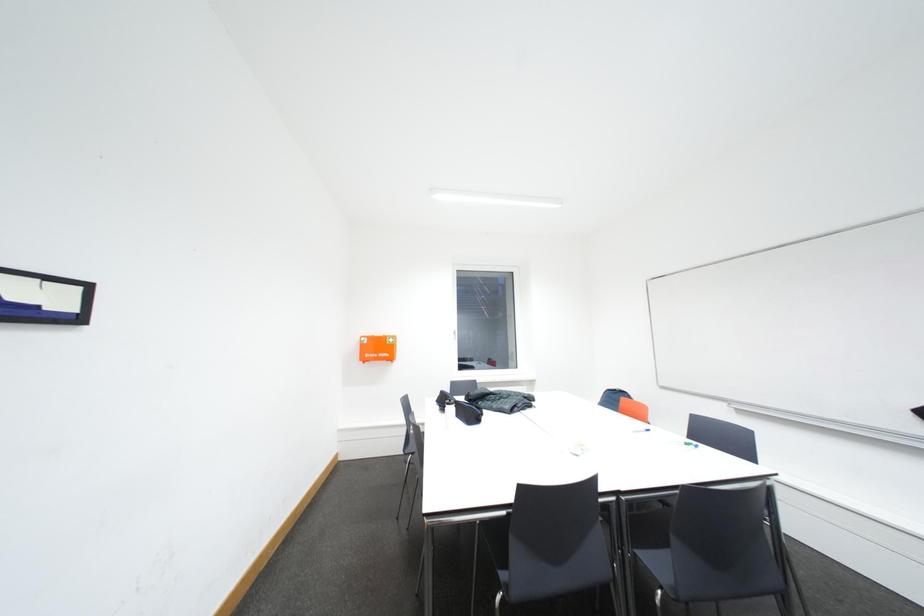
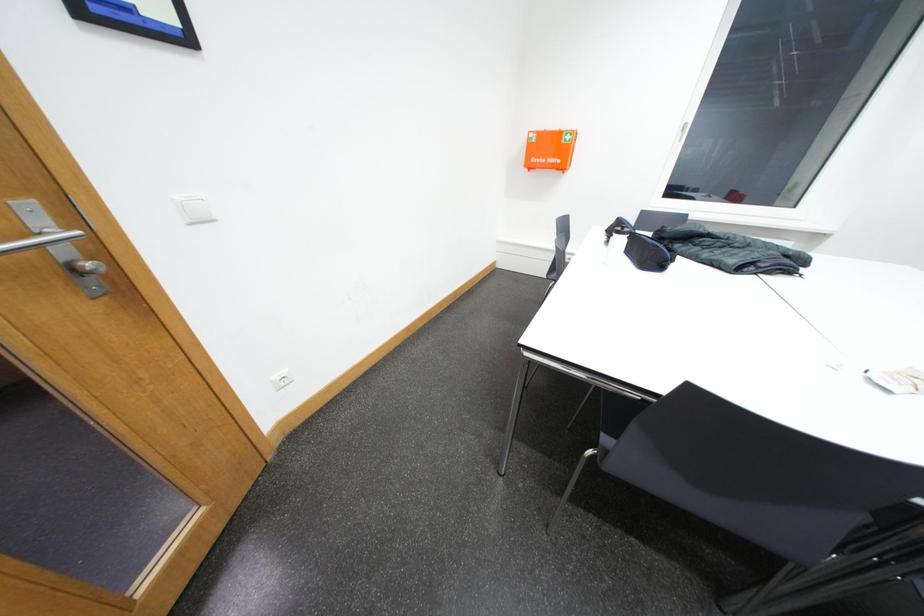
The first image is from the beginning of the video and the second image is from the end. How did the camera likely rotate when shooting the video?

The rotation direction of the camera is left-down.